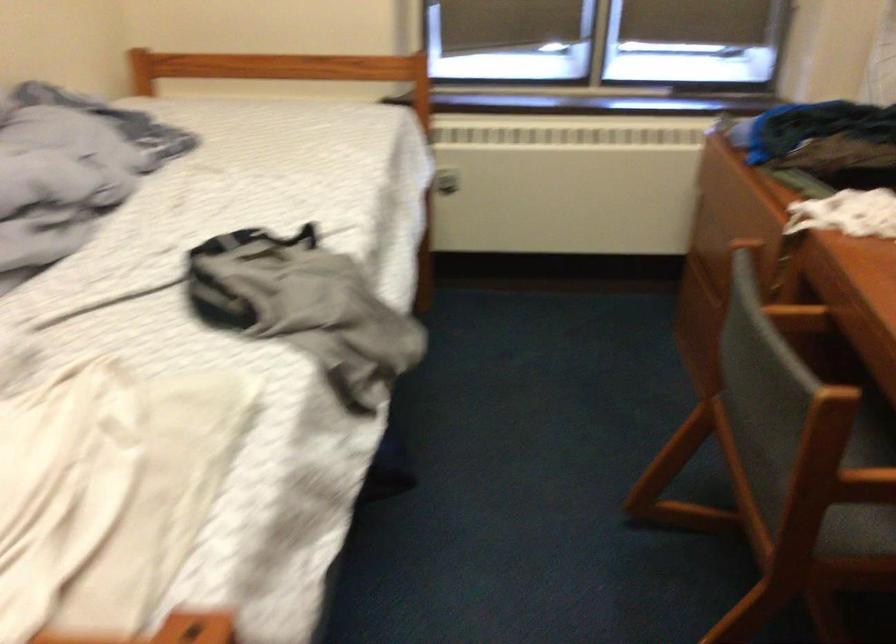
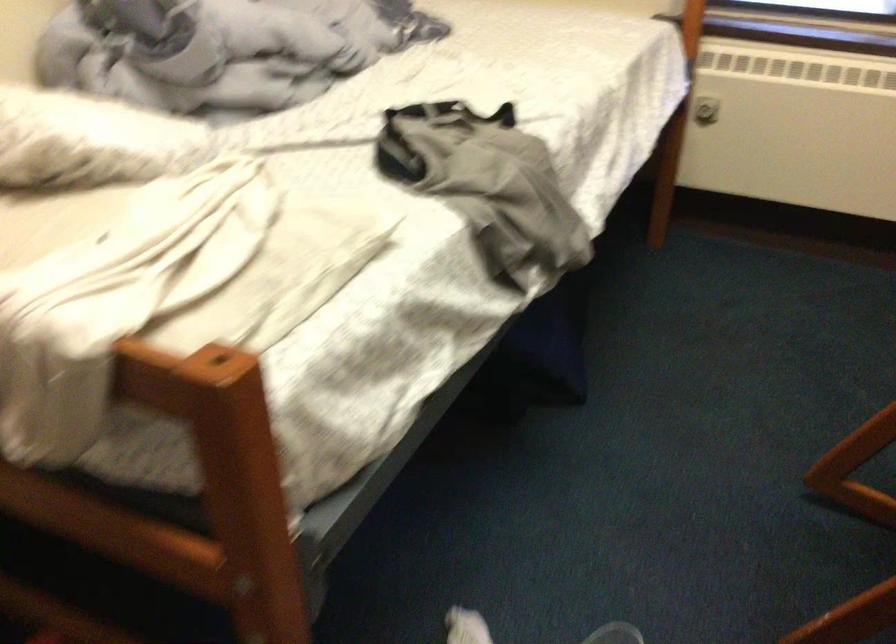
Question: How did the camera likely rotate?

Choices:
 (A) Left
 (B) Right
 (C) Up
 (D) Down

Answer: (A)